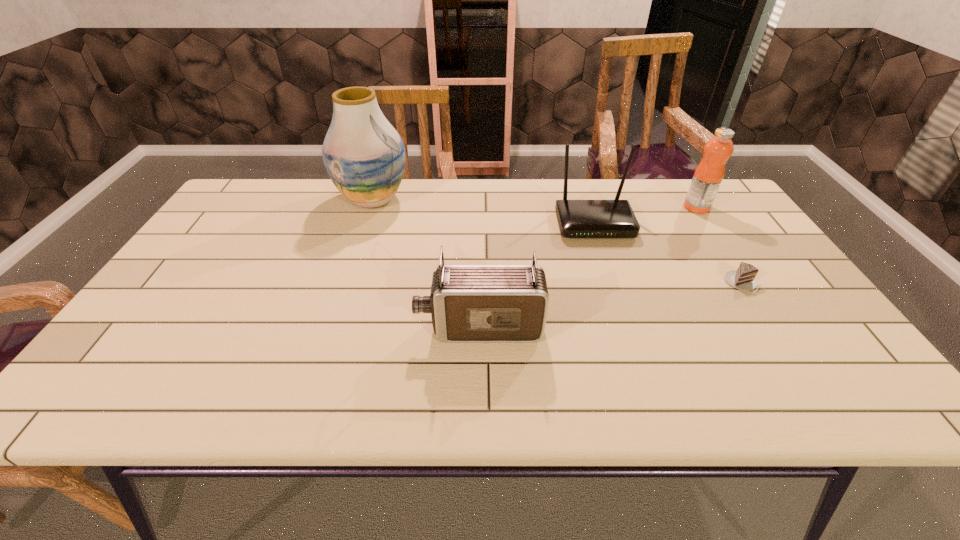
In order to click on free spot between the fruit juice and the router in this screenshot , I will do `click(645, 215)`.

Locate an element on the screen. free space between the fruit juice and the router is located at coordinates (645, 215).

You are a GUI agent. You are given a task and a screenshot of the screen. Output one action in this format:
    pyautogui.click(x=<x>, y=<y>)
    Task: Click on the vacant area between the vase and the fruit juice
    This screenshot has height=540, width=960.
    Given the screenshot: What is the action you would take?
    (x=535, y=203)

Image resolution: width=960 pixels, height=540 pixels. I want to click on vacant point located between the leftmost object and the nearest object, so click(426, 263).

Find the location of a particular element. The image size is (960, 540). free spot between the nearest object and the second nearest object is located at coordinates (612, 305).

Image resolution: width=960 pixels, height=540 pixels. In order to click on object that is the third nearest to the chocolate cake in this screenshot , I will do `click(468, 302)`.

This screenshot has width=960, height=540. Find the location of `object that ranks as the third closest to the third object from left to right`. object that ranks as the third closest to the third object from left to right is located at coordinates (468, 302).

Find the location of a particular element. Image resolution: width=960 pixels, height=540 pixels. vacant space that satisfies the following two spatial constraints: 1. on the front-facing side of the fourth farthest object; 2. on the left side of the third object from right to left is located at coordinates (613, 283).

The image size is (960, 540). What are the coordinates of `vacant area in the image that satisfies the following two spatial constraints: 1. on the front-facing side of the shortest object; 2. on the right side of the third object from left to right` in the screenshot? It's located at (613, 283).

Where is `vacant position in the image that satisfies the following two spatial constraints: 1. on the back side of the chocolate cake; 2. on the left side of the fruit juice`? vacant position in the image that satisfies the following two spatial constraints: 1. on the back side of the chocolate cake; 2. on the left side of the fruit juice is located at coordinates (693, 207).